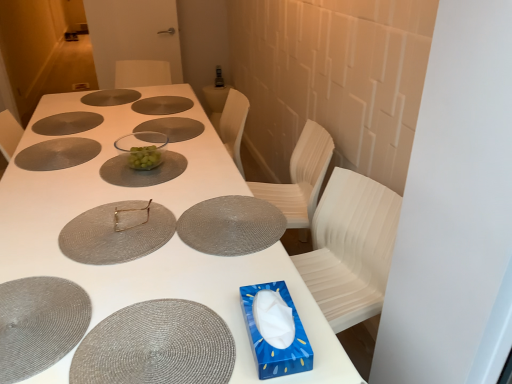
What are the coordinates of `vacant area that lies between matte gray glass plate at upper left, which is the 5th glass plate in back-to-front order, and transparent glass bowl at center, acting as the 6th glass plate starting from the front` in the screenshot? It's located at (115, 137).